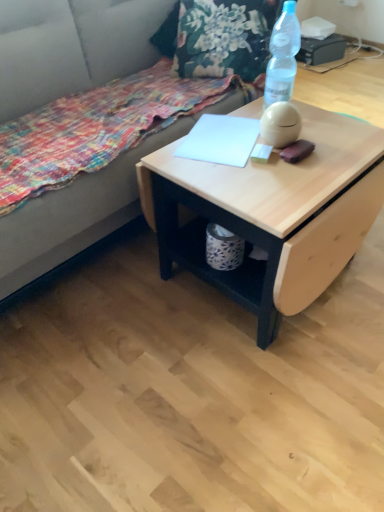
Find the location of a particular element. The width and height of the screenshot is (384, 512). natural wood desk at center is located at coordinates (272, 214).

Measure the distance between natural wood desk at center and camera.

natural wood desk at center and camera are 1.01 meters apart from each other.

The width and height of the screenshot is (384, 512). Identify the location of floral fabric blanket at lower left. (97, 128).

The image size is (384, 512). Describe the element at coordinates (97, 128) in the screenshot. I see `floral fabric blanket at lower left` at that location.

Measure the distance between point (5, 50) and camera.

Point (5, 50) is 4.99 feet away from camera.

This screenshot has width=384, height=512. I want to click on natural wood desk at center, so click(x=272, y=214).

From the image's perspective, which is below, transparent plastic bottle at upper right or floral fabric blanket at lower left?

floral fabric blanket at lower left.

How many degrees apart are the facing directions of transparent plastic bottle at upper right and floral fabric blanket at lower left?

The facing directions of transparent plastic bottle at upper right and floral fabric blanket at lower left are 0.000586 degrees apart.

Who is taller, transparent plastic bottle at upper right or floral fabric blanket at lower left?

Standing taller between the two is transparent plastic bottle at upper right.

From a real-world perspective, is transparent plastic bottle at upper right located higher than floral fabric blanket at lower left?

Yes.

Could you tell me if transparent plastic bottle at upper right is turned towards natural wood desk at center?

No.

Is transparent plastic bottle at upper right inside the boundaries of natural wood desk at center, or outside?

The correct answer is: outside.

From the image's perspective, which is above, transparent plastic bottle at upper right or natural wood desk at center?

transparent plastic bottle at upper right, from the image's perspective.

Measure the distance between transparent plastic bottle at upper right and natural wood desk at center.

The distance of transparent plastic bottle at upper right from natural wood desk at center is 16.59 inches.

Would you say floral fabric blanket at lower left is part of fabric couch at upper left's contents?

Yes, floral fabric blanket at lower left can be found within fabric couch at upper left.

Is fabric couch at upper left smaller than floral fabric blanket at lower left?

Incorrect, fabric couch at upper left is not smaller in size than floral fabric blanket at lower left.

Between fabric couch at upper left and floral fabric blanket at lower left, which one has larger width?

fabric couch at upper left is wider.

Is fabric couch at upper left turned away from floral fabric blanket at lower left?

Correct, fabric couch at upper left is looking away from floral fabric blanket at lower left.

This screenshot has width=384, height=512. In order to click on desk on the right of white paper at center in this screenshot , I will do `click(272, 214)`.

From the image's perspective, between natural wood desk at center and white paper at center, who is located below?

natural wood desk at center is shown below in the image.

Considering the positions of point (343, 254) and point (207, 161), is point (343, 254) closer or farther from the camera than point (207, 161)?

Point (343, 254) is positioned farther from the camera compared to point (207, 161).

Considering the relative sizes of natural wood desk at center and floral fabric blanket at lower left in the image provided, is natural wood desk at center taller than floral fabric blanket at lower left?

Yes, natural wood desk at center is taller than floral fabric blanket at lower left.

Which object is positioned more to the left, natural wood desk at center or floral fabric blanket at lower left?

From the viewer's perspective, floral fabric blanket at lower left appears more on the left side.

Can you confirm if natural wood desk at center is smaller than floral fabric blanket at lower left?

Incorrect, natural wood desk at center is not smaller in size than floral fabric blanket at lower left.

Does natural wood desk at center have a lesser width compared to floral fabric blanket at lower left?

Indeed, natural wood desk at center has a lesser width compared to floral fabric blanket at lower left.

Is floral fabric blanket at lower left further to the viewer compared to fabric couch at upper left?

Yes, it is.

Between floral fabric blanket at lower left and fabric couch at upper left, which one has smaller width?

floral fabric blanket at lower left is thinner.

Is floral fabric blanket at lower left oriented away from fabric couch at upper left?

Absolutely, floral fabric blanket at lower left is directed away from fabric couch at upper left.

Is fabric couch at upper left in front of or behind transparent plastic bottle at upper right in the image?

Visually, fabric couch at upper left is located in front of transparent plastic bottle at upper right.

Considering the sizes of objects fabric couch at upper left and transparent plastic bottle at upper right in the image provided, who is taller, fabric couch at upper left or transparent plastic bottle at upper right?

Standing taller between the two is fabric couch at upper left.

Is transparent plastic bottle at upper right a part of fabric couch at upper left?

No, transparent plastic bottle at upper right is not surrounded by fabric couch at upper left.

Find the location of a particular element. The image size is (384, 512). bottle to the right of floral fabric blanket at lower left is located at coordinates (282, 56).

This screenshot has width=384, height=512. Find the location of `desk located on the left of transparent plastic bottle at upper right`. desk located on the left of transparent plastic bottle at upper right is located at coordinates (272, 214).

Which object lies nearer to the anchor point white paper at center, natural wood desk at center or transparent plastic bottle at upper right?

Based on the image, transparent plastic bottle at upper right appears to be nearer to white paper at center.

Based on their spatial positions, is fabric couch at upper left or white paper at center further from transparent plastic bottle at upper right?

The object further to transparent plastic bottle at upper right is fabric couch at upper left.

From the image, which object appears to be nearer to natural wood desk at center, floral fabric blanket at lower left or fabric couch at upper left?

floral fabric blanket at lower left.

Looking at the image, which one is located further to transparent plastic bottle at upper right, fabric couch at upper left or natural wood desk at center?

fabric couch at upper left.

Based on their spatial positions, is fabric couch at upper left or floral fabric blanket at lower left further from natural wood desk at center?

fabric couch at upper left lies further to natural wood desk at center than the other object.

Which object lies further to the anchor point transparent plastic bottle at upper right, floral fabric blanket at lower left or fabric couch at upper left?

fabric couch at upper left is further to transparent plastic bottle at upper right.

Considering their positions, is transparent plastic bottle at upper right positioned further to floral fabric blanket at lower left than white paper at center?

transparent plastic bottle at upper right.

Considering their positions, is natural wood desk at center positioned further to fabric couch at upper left than transparent plastic bottle at upper right?

natural wood desk at center is positioned further to the anchor fabric couch at upper left.

This screenshot has height=512, width=384. Identify the location of blanket located between fabric couch at upper left and transparent plastic bottle at upper right in the left-right direction. (97, 128).

Image resolution: width=384 pixels, height=512 pixels. What are the coordinates of `blanket located between fabric couch at upper left and natural wood desk at center in the left-right direction` in the screenshot? It's located at (97, 128).

At what (x,y) coordinates should I click in order to perform the action: click on notepad situated between fabric couch at upper left and natural wood desk at center from left to right. Please return your answer as a coordinate pair (x, y). Image resolution: width=384 pixels, height=512 pixels. Looking at the image, I should click on tap(220, 140).

Identify the location of notepad located between floral fabric blanket at lower left and transparent plastic bottle at upper right in the left-right direction. The height and width of the screenshot is (512, 384). pos(220,140).